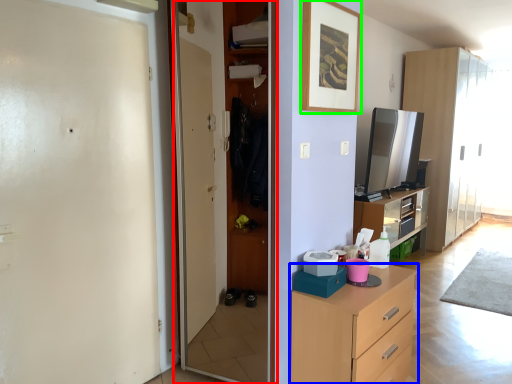
Question: Which is nearer to the screen door (highlighted by a red box)? chest of drawers (highlighted by a blue box) or picture frame (highlighted by a green box).

Choices:
 (A) chest of drawers
 (B) picture frame

Answer: (A)